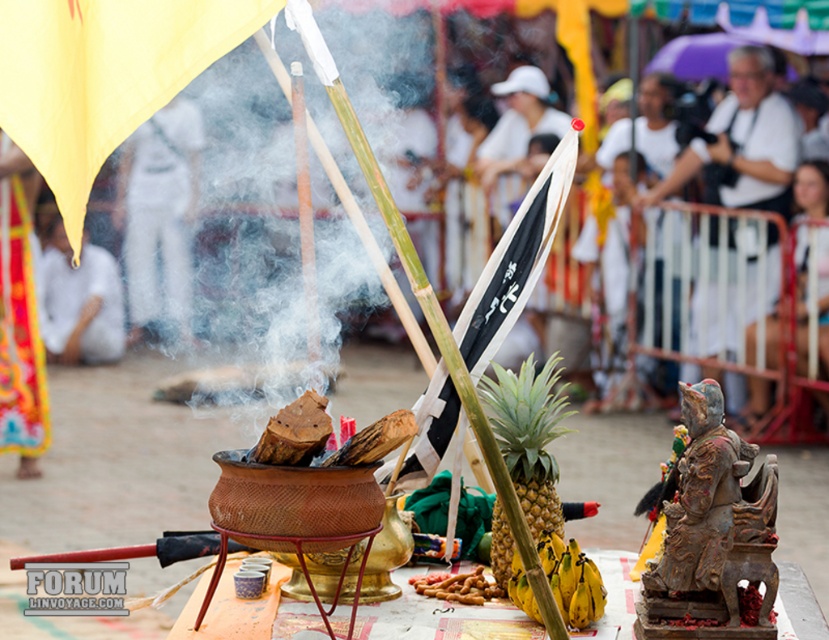
You are standing in the festival scene and want to locate the white cotton shirt at upper center. Based on the coordinates given, where would you look relative to the ceremonial brazier?

The white cotton shirt at upper center is located at coordinates point (158, 216), which is to the upper left of the ceremonial brazier.